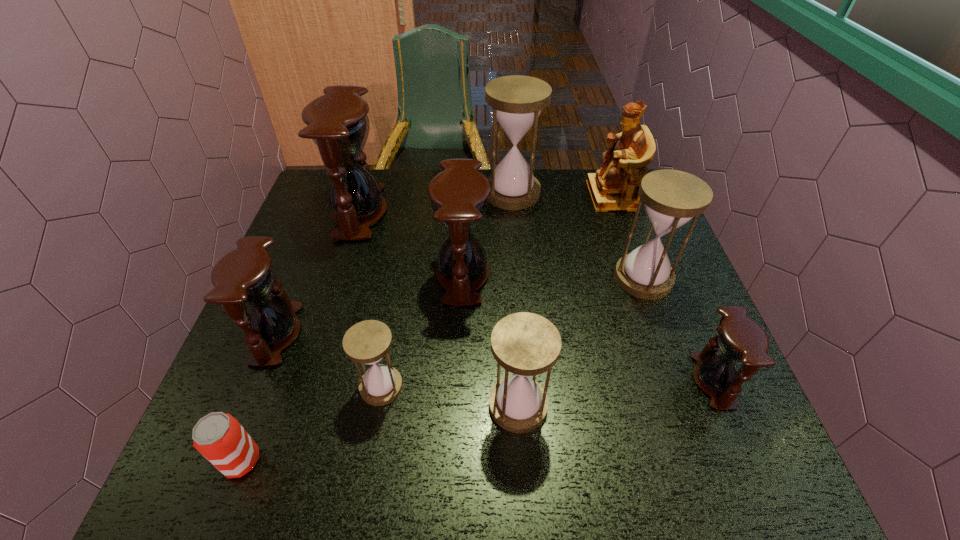
This screenshot has height=540, width=960. Identify the location of the biggest brown hourglass. (337, 122).

Locate an element on the screen. The width and height of the screenshot is (960, 540). the biggest white hourglass is located at coordinates (516, 100).

The image size is (960, 540). Find the location of `figurine`. figurine is located at coordinates (613, 188).

Find the location of a particular element. the second biggest brown hourglass is located at coordinates [x=459, y=195].

The width and height of the screenshot is (960, 540). Find the location of `the rightmost white hourglass`. the rightmost white hourglass is located at coordinates (672, 198).

Find the location of a particular element. the third smallest white hourglass is located at coordinates (672, 198).

This screenshot has width=960, height=540. In order to click on the third biggest brown hourglass in this screenshot , I will do `click(245, 276)`.

I want to click on the third biggest white hourglass, so click(526, 344).

You are a GUI agent. You are given a task and a screenshot of the screen. Output one action in this format:
    pyautogui.click(x=<x>, y=<y>)
    Task: Click on the smallest brown hourglass
    This screenshot has height=540, width=960.
    Given the screenshot: What is the action you would take?
    pyautogui.click(x=740, y=339)

Locate an element on the screen. The width and height of the screenshot is (960, 540). the fourth object from left to right is located at coordinates coord(367,342).